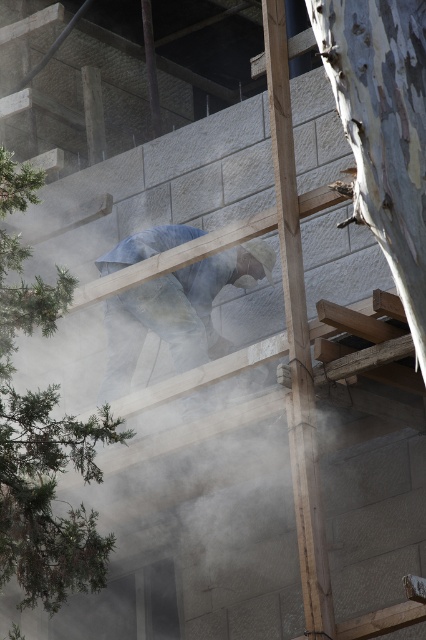
You are a construction inspector checking the scaffolding at the construction site. You notice a point marked at coordinates (x=296, y=339). What type of material is present at that specific point?

The point at coordinates (x=296, y=339) has a smooth wood beam at center.

You are a safety inspector observing the construction site. You notice the smooth wood beam at center and the blue denim jeans at center. Which object is positioned closer to your viewpoint?

The smooth wood beam at center is closer to the viewer than the blue denim jeans at center.

You are a safety inspector at the construction site. You notice the smooth wood beam at center and the blue denim jeans at center. According to safety regulations, all workers must maintain a minimum distance of 30 cm between themselves and any wooden beams to prevent accidents. Can you determine if the worker is complying with this regulation?

The smooth wood beam at center is located below blue denim jeans at center, which means the worker is positioned above the beam. Since the beam is below the jeans, the worker is not within the 30 cm proximity requirement, so they are complying with the safety regulation.